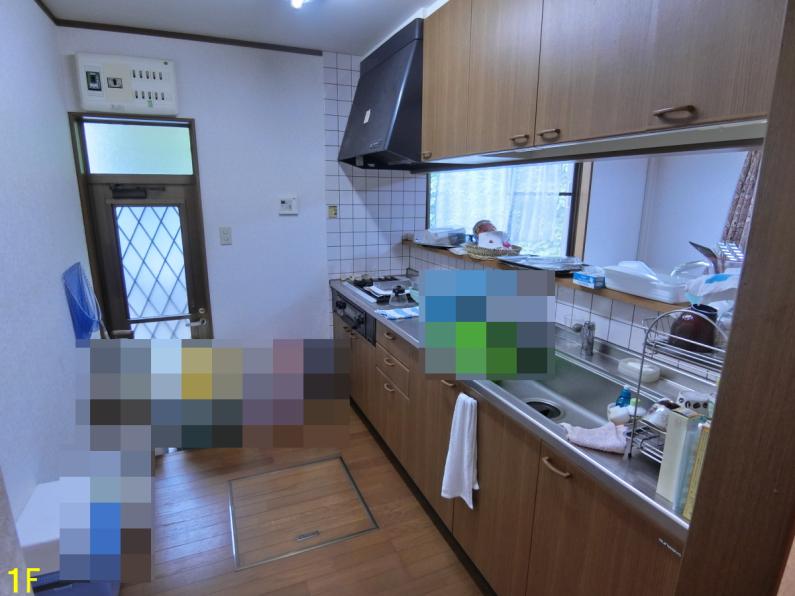
I want to click on exhaust hood, so click(x=379, y=104).